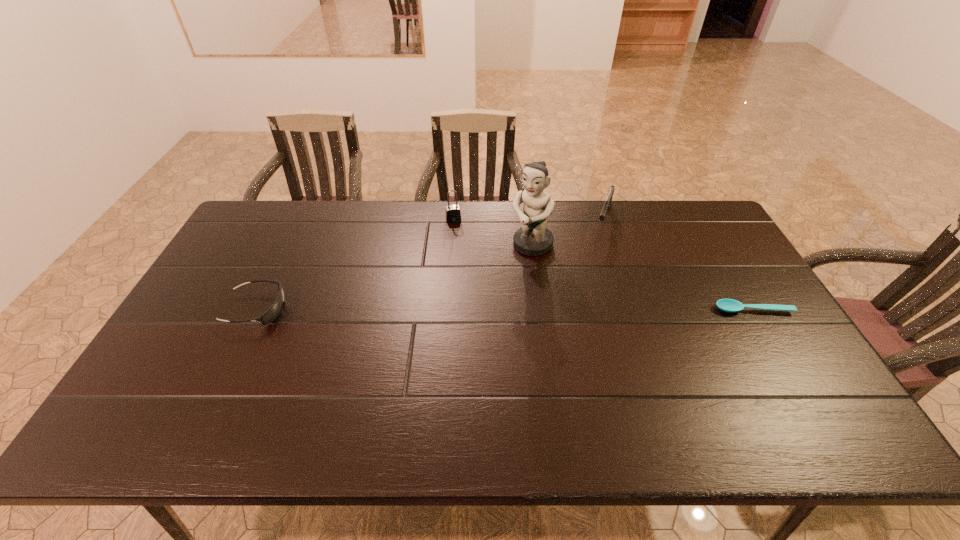
Find the location of `free point located on the lenses of the leftmost object`. free point located on the lenses of the leftmost object is located at coordinates (332, 309).

At what (x,y) coordinates should I click in order to perform the action: click on vacant region located 0.200m on the front of the shortest object. Please return your answer as a coordinate pair (x, y). This screenshot has width=960, height=540. Looking at the image, I should click on (793, 376).

Find the location of `free spot located on the front-facing side of the third object from right to left`. free spot located on the front-facing side of the third object from right to left is located at coordinates (486, 293).

At what (x,y) coordinates should I click in order to perform the action: click on vacant space located 0.070m on the front-facing side of the third object from right to left. Please return your answer as a coordinate pair (x, y). This screenshot has height=540, width=960. Looking at the image, I should click on (509, 268).

Where is `vacant space located on the front-facing side of the third object from right to left`? This screenshot has width=960, height=540. vacant space located on the front-facing side of the third object from right to left is located at coordinates (492, 285).

Identify the location of free space located on the shackle of the fourth object from right to left. Image resolution: width=960 pixels, height=540 pixels. (466, 267).

The height and width of the screenshot is (540, 960). Identify the location of free region located on the shackle of the fourth object from right to left. (466, 269).

The width and height of the screenshot is (960, 540). In order to click on vacant region located on the shackle of the fourth object from right to left in this screenshot , I will do `click(464, 259)`.

This screenshot has height=540, width=960. Identify the location of blank space located 0.140m at the muzzle end of the second object from right to left. (596, 259).

Where is `vacant space situated at the muzzle end of the second object from right to left`? The width and height of the screenshot is (960, 540). vacant space situated at the muzzle end of the second object from right to left is located at coordinates (580, 309).